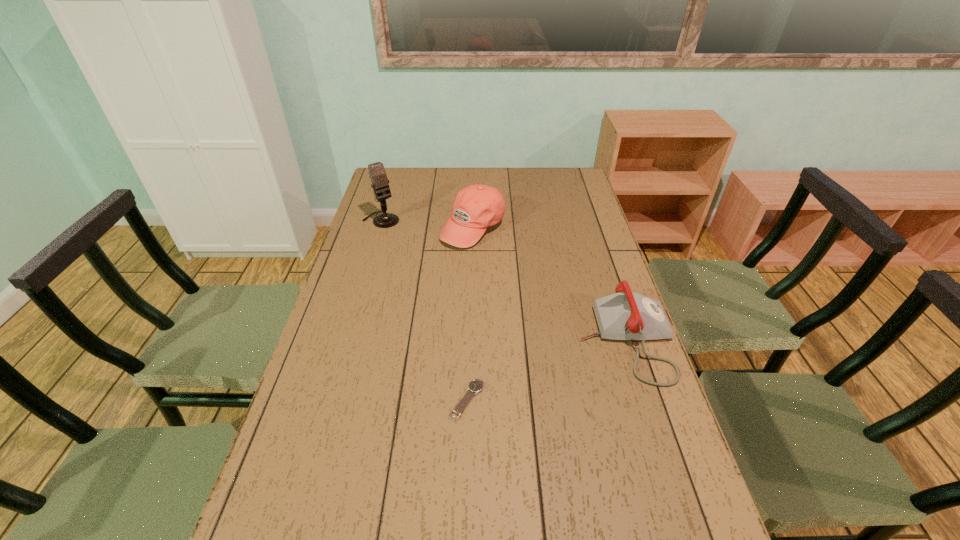
I want to click on watch, so click(x=475, y=386).

The width and height of the screenshot is (960, 540). Find the location of `the second shortest object`. the second shortest object is located at coordinates (624, 315).

What are the coordinates of `the rightmost object` in the screenshot? It's located at (624, 315).

Where is `baseball cap`? The height and width of the screenshot is (540, 960). baseball cap is located at coordinates click(476, 207).

Locate an element on the screen. microphone is located at coordinates (377, 173).

Locate an element on the screen. This screenshot has height=540, width=960. the leftmost object is located at coordinates (377, 173).

You are a GUI agent. You are given a task and a screenshot of the screen. Output one action in this format:
    pyautogui.click(x=<x>, y=<y>)
    Task: Click on the vacant space located on the back of the watch
    The width and height of the screenshot is (960, 540).
    Given the screenshot: What is the action you would take?
    pyautogui.click(x=468, y=347)

This screenshot has height=540, width=960. Identify the location of blank space located on the front-facing side of the second tallest object. (512, 283).

At what (x,y) coordinates should I click in order to perform the action: click on vacant region located on the front-facing side of the second tallest object. Please return your answer as a coordinate pair (x, y). The width and height of the screenshot is (960, 540). Looking at the image, I should click on (530, 307).

You are a GUI agent. You are given a task and a screenshot of the screen. Output one action in this format:
    pyautogui.click(x=<x>, y=<y>)
    Task: Click on the vacant area situated on the front-facing side of the second tallest object
    The height and width of the screenshot is (540, 960).
    Given the screenshot: What is the action you would take?
    pyautogui.click(x=512, y=283)